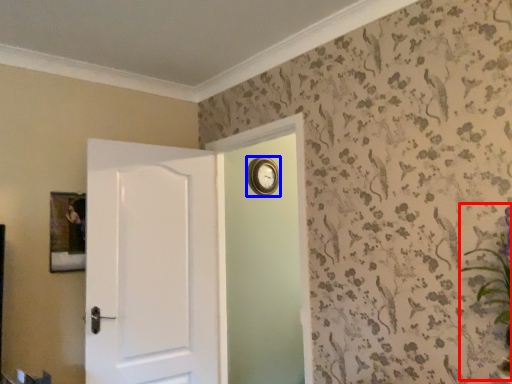
Question: Which of the following is the closest to the observer, floral arrangement (highlighted by a red box) or clock (highlighted by a blue box)?

Choices:
 (A) floral arrangement
 (B) clock

Answer: (A)